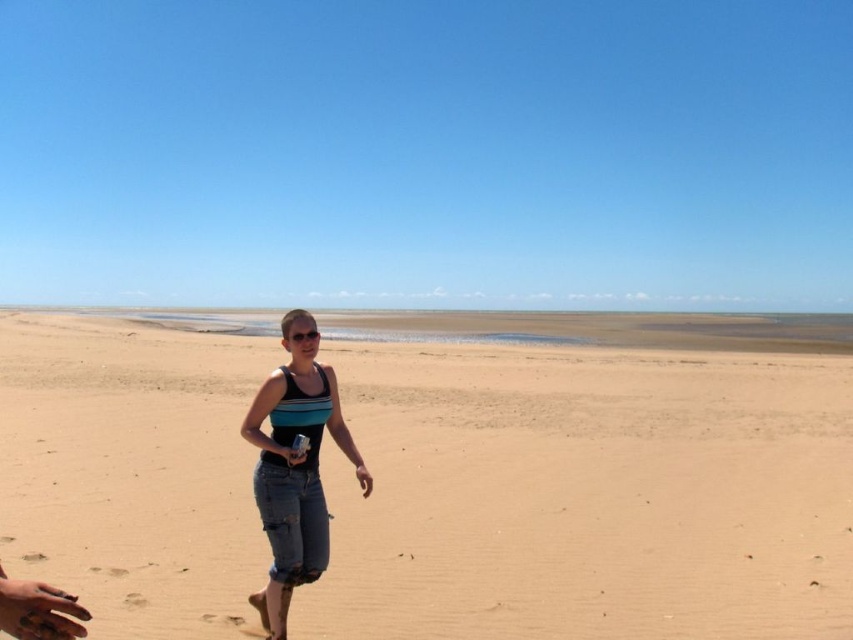
Based on the photo, you are a photographer trying to capture the person in the scene. The denim shorts at center and smooth tan skin at lower center are important for the shot. Which one should you focus on if you want to ensure the lower part of the body is in sharp focus?

You should focus on the smooth tan skin at lower center because it is located lower on the body than the denim shorts at center, which is above it.